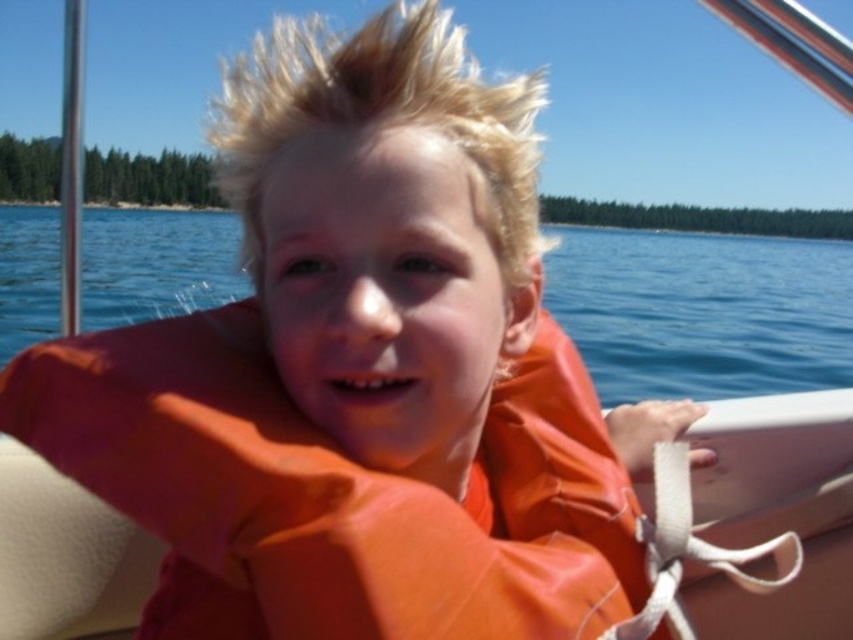
Between point (144, 426) and point (780, 259), which one is positioned in front?

Point (144, 426) is in front.

Which is above, orange matte life jacket at center or blue water at center?

blue water at center is above.

Who is more forward, (612, 609) or (669, 248)?

Positioned in front is point (612, 609).

Where is `orange matte life jacket at center`? The width and height of the screenshot is (853, 640). orange matte life jacket at center is located at coordinates (331, 492).